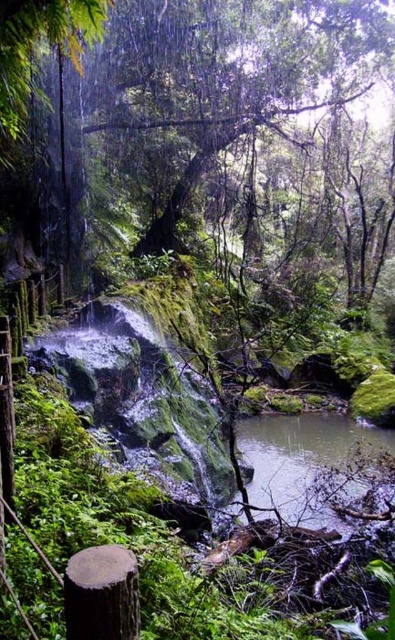
Looking at this image, you are a hiker who wants to cross the forest floor to reach the calm pool. You notice a green mossy stream at lower center. Can you step on the mossy stream at point (x=304, y=464) to cross?

The green mossy stream at lower center is located at point (x=304, y=464), so yes, you can step on the mossy stream at that point to cross the forest floor towards the calm pool.

You are navigating through the forest and want to reach the waterfall. You have two reference points marked as point [248,461] and point [118,572]. Which point should you prioritize visiting first to stay on the correct path towards the waterfall?

You should prioritize visiting point [118,572] first because point [248,461] is behind it, meaning point [118,572] is closer to your current position and thus should be reached first on the path towards the waterfall.

You are a hiker trying to cross the forest floor. You see the green mossy stream at lower center and the brown rough tree stump at lower left. Which object is located to the right of the other?

The green mossy stream at lower center is positioned on the right side of brown rough tree stump at lower left.